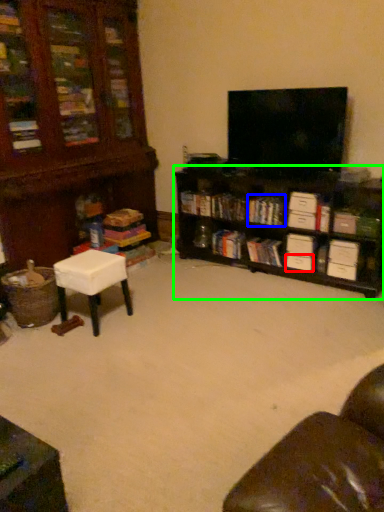
Question: Considering the real-world distances, which object is closest to drawer (highlighted by a red box)? book (highlighted by a blue box) or shelf (highlighted by a green box).

Choices:
 (A) book
 (B) shelf

Answer: (A)